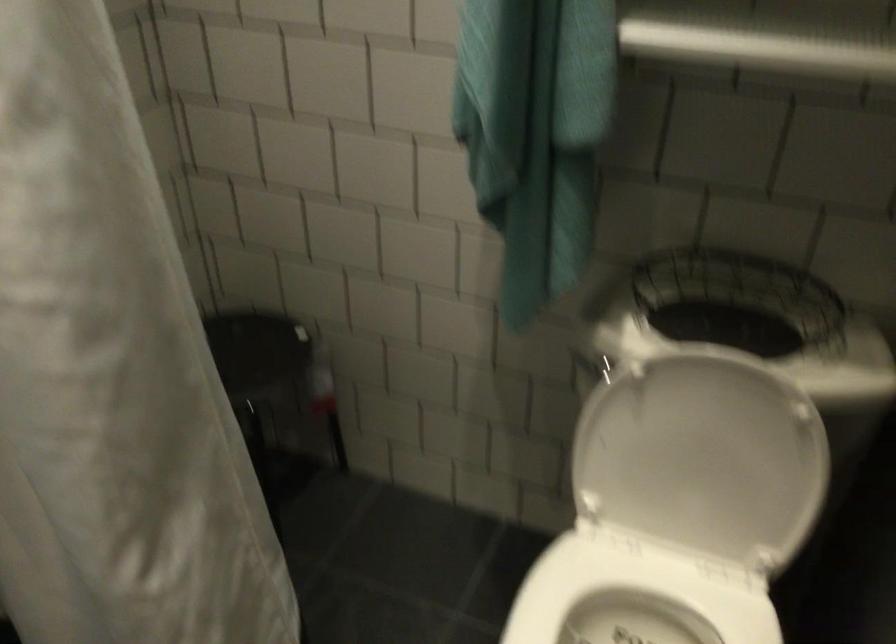
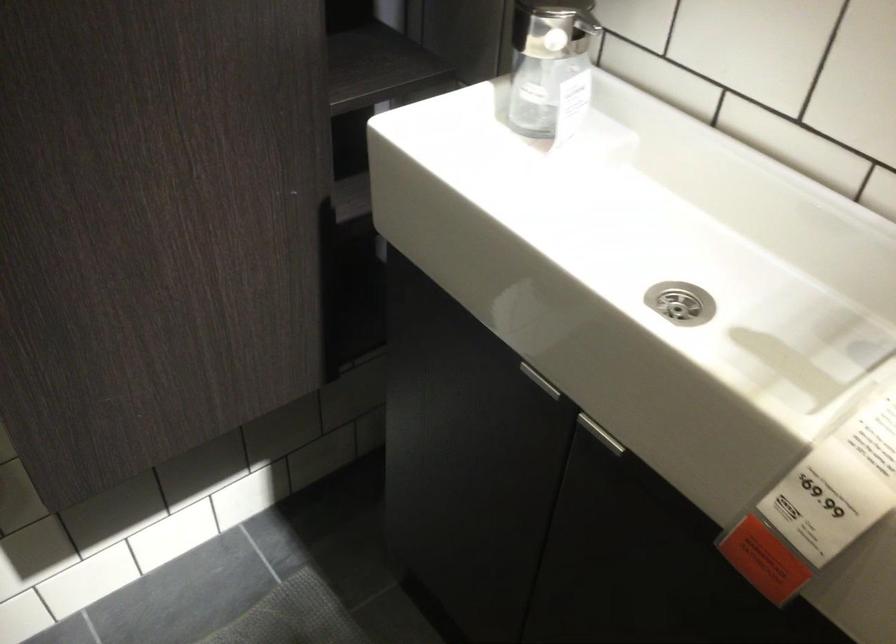
The first image is from the beginning of the video and the second image is from the end. How did the camera likely rotate when shooting the video?

The rotation direction of the camera is left-down.